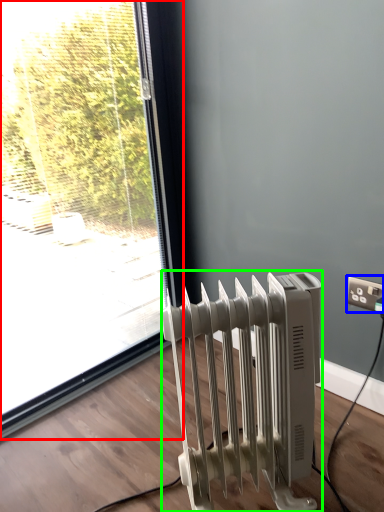
Question: Which is farther away from window (highlighted by a red box)? electric outlet (highlighted by a blue box) or radiator (highlighted by a green box)?

Choices:
 (A) electric outlet
 (B) radiator

Answer: (A)